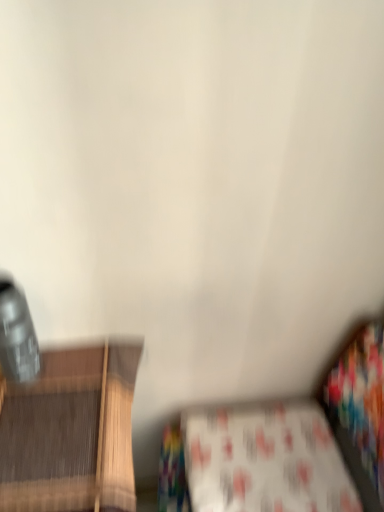
Question: From a real-world perspective, is white printed fabric at lower center above or below white fabric couch at lower right?

Choices:
 (A) above
 (B) below

Answer: (A)

Question: Is white printed fabric at lower center in front of or behind white fabric couch at lower right in the image?

Choices:
 (A) behind
 (B) front

Answer: (A)

Question: From the image's perspective, is white printed fabric at lower center located above or below white fabric couch at lower right?

Choices:
 (A) above
 (B) below

Answer: (A)

Question: Is white fabric couch at lower right spatially inside white printed fabric at lower center, or outside of it?

Choices:
 (A) inside
 (B) outside

Answer: (B)

Question: Is point (259, 501) closer or farther from the camera than point (236, 442)?

Choices:
 (A) closer
 (B) farther

Answer: (A)

Question: From a real-world perspective, is white fabric couch at lower right physically located above or below white printed fabric at lower center?

Choices:
 (A) below
 (B) above

Answer: (A)

Question: Would you say white fabric couch at lower right is to the left or to the right of white printed fabric at lower center in the picture?

Choices:
 (A) left
 (B) right

Answer: (A)